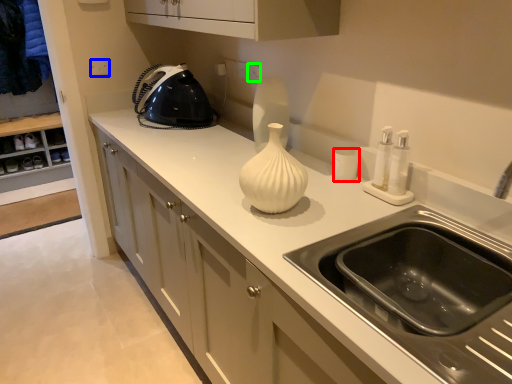
Question: Based on their relative distances, which object is nearer to kitchen appliance (highlighted by a red box)? Choose from electric outlet (highlighted by a blue box) and electric outlet (highlighted by a green box).

Choices:
 (A) electric outlet
 (B) electric outlet

Answer: (B)